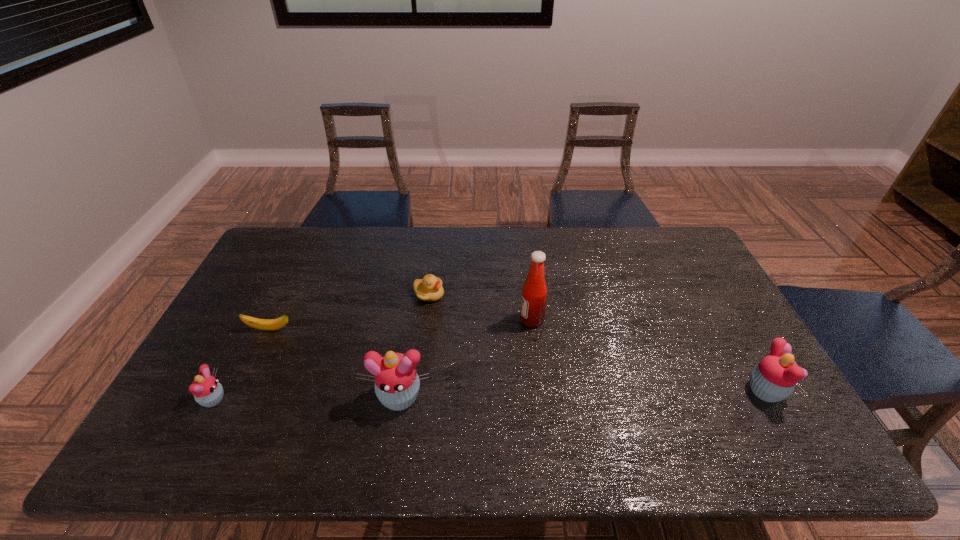
Identify the location of free point between the farthest object and the rightmost cupcake. The image size is (960, 540). (597, 343).

Locate an element on the screen. The image size is (960, 540). vacant area between the rightmost object and the second cupcake from left to right is located at coordinates (583, 394).

The height and width of the screenshot is (540, 960). I want to click on free space between the leftmost cupcake and the rightmost cupcake, so click(490, 396).

At what (x,y) coordinates should I click in order to perform the action: click on vacant area that lies between the banana and the farthest object. Please return your answer as a coordinate pair (x, y). The image size is (960, 540). Looking at the image, I should click on (349, 312).

Where is `free space that is in between the banana and the second cupcake from right to left`? free space that is in between the banana and the second cupcake from right to left is located at coordinates click(335, 363).

Locate which object is the third closest to the leftmost cupcake. Please provide its 2D coordinates. Your answer should be formatted as a tuple, i.e. [(x, y)], where the tuple contains the x and y coordinates of a point satisfying the conditions above.

[(429, 289)]

Point out which object is positioned as the fifth nearest to the second cupcake from right to left. Please provide its 2D coordinates. Your answer should be formatted as a tuple, i.e. [(x, y)], where the tuple contains the x and y coordinates of a point satisfying the conditions above.

[(774, 378)]

Locate an element on the screen. The width and height of the screenshot is (960, 540). cupcake identified as the closest to the condiment is located at coordinates (397, 383).

Choose which cupcake is the nearest neighbor to the farthest object. Please provide its 2D coordinates. Your answer should be formatted as a tuple, i.e. [(x, y)], where the tuple contains the x and y coordinates of a point satisfying the conditions above.

[(397, 383)]

This screenshot has width=960, height=540. Identify the location of free space that satisfies the following two spatial constraints: 1. on the front-facing side of the tallest object; 2. on the face of the second cupcake from left to right. (541, 397).